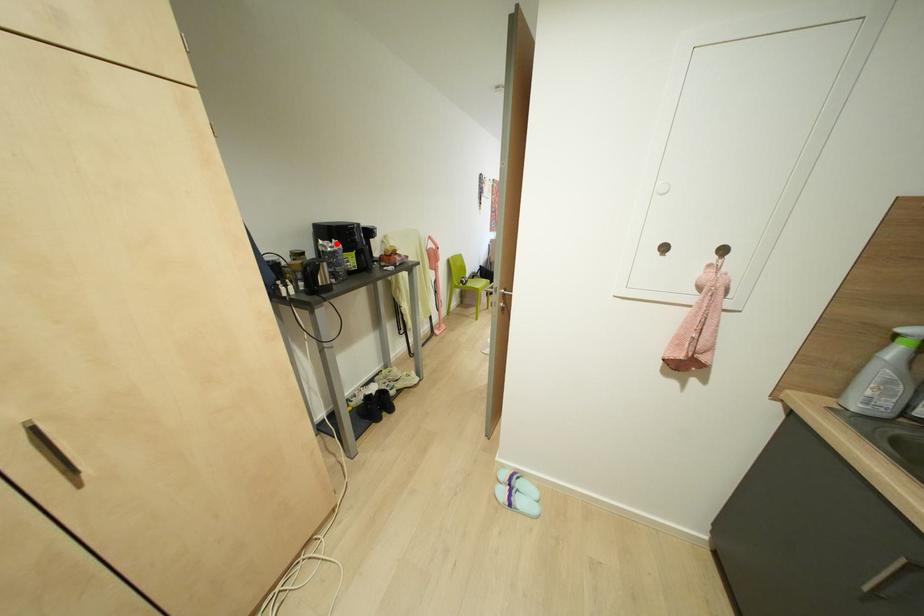
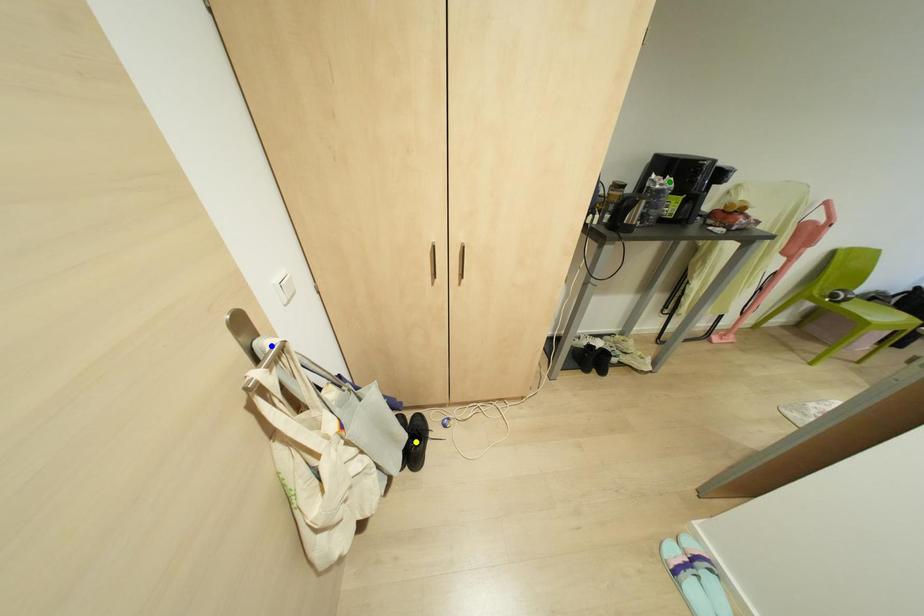
Question: I am providing you with two images of the same scene from different viewpoints. A red point is marked on the first image. You are given multiple points on the second image. Which mark in image 2 goes with the point in image 1?

Choices:
 (A) blue point
 (B) yellow point
 (C) green point

Answer: (C)